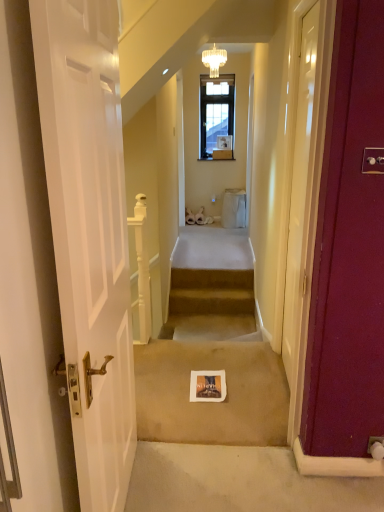
This screenshot has width=384, height=512. I want to click on white wooden door at left, which appears as the 2th door when viewed from the right, so click(89, 234).

What do you see at coordinates (211, 366) in the screenshot? I see `beige carpet at center` at bounding box center [211, 366].

Locate an element on the screen. white glossy door at right, the 2th door in the front-to-back sequence is located at coordinates (299, 192).

Describe the element at coordinates (211, 292) in the screenshot. I see `beige carpeted stairs at center` at that location.

Locate an element on the screen. beige carpeted stairs at center is located at coordinates (211, 292).

You are a GUI agent. You are given a task and a screenshot of the screen. Output one action in this format:
    pyautogui.click(x=<x>, y=<y>)
    Task: Click on the white wooden door at left, which appears as the 2th door when viewed from the right
    The height and width of the screenshot is (512, 384).
    Given the screenshot: What is the action you would take?
    pyautogui.click(x=89, y=234)

Which of these two, white wooden door at left, which ranks as the first door in front-to-back order, or beige carpet at center, is smaller?

beige carpet at center is smaller.

Considering the relative positions of white wooden door at left, marked as the second door in a back-to-front arrangement, and beige carpet at center in the image provided, is white wooden door at left, marked as the second door in a back-to-front arrangement, to the left of beige carpet at center from the viewer's perspective?

Indeed, white wooden door at left, marked as the second door in a back-to-front arrangement, is positioned on the left side of beige carpet at center.

Considering the relative sizes of white wooden door at left, which ranks as the first door in front-to-back order, and beige carpet at center in the image provided, is white wooden door at left, which ranks as the first door in front-to-back order, taller than beige carpet at center?

Indeed, white wooden door at left, which ranks as the first door in front-to-back order, has a greater height compared to beige carpet at center.

From the image's perspective, does white glossy door at right, the first door from the right, appear higher than beige carpet at center?

Yes, from the image's perspective, white glossy door at right, the first door from the right, is above beige carpet at center.

Could you tell me if white glossy door at right, which is counted as the 1th door, starting from the back, is turned towards beige carpet at center?

Yes, white glossy door at right, which is counted as the 1th door, starting from the back, faces towards beige carpet at center.

From a real-world perspective, is white glossy door at right, the first door from the right, above or below beige carpet at center?

Clearly, from a real-world perspective, white glossy door at right, the first door from the right, is above beige carpet at center.

Consider the image. Is white glossy door at right, the second door when ordered from left to right, positioned beyond the bounds of beige carpet at center?

Yes, white glossy door at right, the second door when ordered from left to right, is located beyond the bounds of beige carpet at center.

Where is `the 2nd door in front when counting from the gold textured chandelier at upper center`? The width and height of the screenshot is (384, 512). the 2nd door in front when counting from the gold textured chandelier at upper center is located at coordinates (89, 234).

From a real-world perspective, which object stands above the other?

gold textured chandelier at upper center.

Could white wooden door at left, which appears as the 2th door when viewed from the right, be considered to be inside gold textured chandelier at upper center?

Definitely not — white wooden door at left, which appears as the 2th door when viewed from the right, is not inside gold textured chandelier at upper center.

Is gold textured chandelier at upper center not close to white wooden door at left, which appears as the 2th door when viewed from the right?

Indeed, gold textured chandelier at upper center is not near white wooden door at left, which appears as the 2th door when viewed from the right.

Looking at this image, is white wooden door at left, which appears as the 2th door when viewed from the right, behind gold textured chandelier at upper center?

No, white wooden door at left, which appears as the 2th door when viewed from the right, is closer to the camera.

Between point (61, 96) and point (208, 60), which one is positioned in front?

The point (61, 96) is closer to the camera.

Who is taller, white wooden door at left, marked as the second door in a back-to-front arrangement, or gold textured chandelier at upper center?

white wooden door at left, marked as the second door in a back-to-front arrangement.

In the scene shown: Is white wooden door at left, which appears as the 2th door when viewed from the right, looking in the opposite direction of gold textured chandelier at upper center?

white wooden door at left, which appears as the 2th door when viewed from the right, does not have its back to gold textured chandelier at upper center.

Can you confirm if white glossy door at right, the 2th door in the front-to-back sequence, is thinner than white wooden door at left, which ranks as the first door in front-to-back order?

Yes, white glossy door at right, the 2th door in the front-to-back sequence, is thinner than white wooden door at left, which ranks as the first door in front-to-back order.

Does point (311, 67) appear closer or farther from the camera than point (101, 46)?

Point (311, 67) is farther from the camera than point (101, 46).

Does white glossy door at right, the first door from the right, turn towards white wooden door at left, which is the first door from left to right?

No, white glossy door at right, the first door from the right, does not turn towards white wooden door at left, which is the first door from left to right.

From the image's perspective, which object appears higher, white glossy door at right, the first door from the right, or white wooden door at left, which is the first door from left to right?

white glossy door at right, the first door from the right, is shown above in the image.

What's the angular difference between beige carpeted stairs at center and gold textured chandelier at upper center's facing directions?

The angle between the facing direction of beige carpeted stairs at center and the facing direction of gold textured chandelier at upper center is 3.2 degrees.

Does point (173, 274) appear closer or farther from the camera than point (217, 63)?

Point (173, 274) is positioned closer to the camera compared to point (217, 63).

Between beige carpeted stairs at center and gold textured chandelier at upper center, which one has larger width?

Wider between the two is gold textured chandelier at upper center.

Based on their sizes in the image, would you say beige carpeted stairs at center is bigger or smaller than gold textured chandelier at upper center?

In the image, beige carpeted stairs at center appears to be larger than gold textured chandelier at upper center.

From a real-world perspective, between beige carpeted stairs at center and white glossy door at right, the second door when ordered from left to right, who is vertically lower?

beige carpeted stairs at center.

Does beige carpeted stairs at center have a lesser height compared to white glossy door at right, the 2th door in the front-to-back sequence?

Indeed, beige carpeted stairs at center has a lesser height compared to white glossy door at right, the 2th door in the front-to-back sequence.

Is point (232, 277) positioned behind point (297, 254)?

Yes, point (232, 277) is farther from viewer.

Which of these two, beige carpeted stairs at center or white glossy door at right, the second door when ordered from left to right, is thinner?

white glossy door at right, the second door when ordered from left to right, is thinner.

Where is `stairwell that is under the white wooden door at left, marked as the second door in a back-to-front arrangement (from a real-world perspective)`? Image resolution: width=384 pixels, height=512 pixels. stairwell that is under the white wooden door at left, marked as the second door in a back-to-front arrangement (from a real-world perspective) is located at coordinates (211, 366).

This screenshot has height=512, width=384. What are the coordinates of `stairwell lying behind the white glossy door at right, the 2th door in the front-to-back sequence` in the screenshot? It's located at (211, 366).

Looking at the image, which one is located closer to gold textured chandelier at upper center, white wooden door at left, which appears as the 2th door when viewed from the right, or beige carpet at center?

The object closer to gold textured chandelier at upper center is beige carpet at center.

Estimate the real-world distances between objects in this image. Which object is further from beige carpet at center, gold textured chandelier at upper center or white wooden door at left, which is the first door from left to right?

Among the two, gold textured chandelier at upper center is located further to beige carpet at center.

When comparing their distances from gold textured chandelier at upper center, does white glossy door at right, the first door from the right, or white wooden door at left, which appears as the 2th door when viewed from the right, seem further?

white wooden door at left, which appears as the 2th door when viewed from the right.

Which object lies further to the anchor point beige carpet at center, gold textured chandelier at upper center or white glossy door at right, the 2th door in the front-to-back sequence?

gold textured chandelier at upper center lies further to beige carpet at center than the other object.

Which object lies nearer to the anchor point white glossy door at right, the first door from the right, gold textured chandelier at upper center or white wooden door at left, which ranks as the first door in front-to-back order?

Based on the image, white wooden door at left, which ranks as the first door in front-to-back order, appears to be nearer to white glossy door at right, the first door from the right.

Looking at the image, which one is located closer to white glossy door at right, the first door from the right, beige carpeted stairs at center or beige carpet at center?

The object closer to white glossy door at right, the first door from the right, is beige carpet at center.

Looking at the image, which one is located closer to white wooden door at left, which appears as the 2th door when viewed from the right, gold textured chandelier at upper center or white glossy door at right, the 2th door in the front-to-back sequence?

white glossy door at right, the 2th door in the front-to-back sequence.

From the picture: Based on their spatial positions, is gold textured chandelier at upper center or beige carpeted stairs at center closer to white wooden door at left, marked as the second door in a back-to-front arrangement?

beige carpeted stairs at center is positioned closer to the anchor white wooden door at left, marked as the second door in a back-to-front arrangement.

Locate an element on the screen. The image size is (384, 512). stairwell between white wooden door at left, which is the first door from left to right, and beige carpeted stairs at center from front to back is located at coordinates (211, 366).

Where is `stairwell positioned between white wooden door at left, which ranks as the first door in front-to-back order, and gold textured chandelier at upper center from near to far`? stairwell positioned between white wooden door at left, which ranks as the first door in front-to-back order, and gold textured chandelier at upper center from near to far is located at coordinates (211, 366).

The image size is (384, 512). I want to click on stairs between white glossy door at right, the second door when ordered from left to right, and gold textured chandelier at upper center, along the z-axis, so click(x=211, y=292).

This screenshot has width=384, height=512. I want to click on door between white wooden door at left, which appears as the 2th door when viewed from the right, and beige carpet at center, along the z-axis, so click(x=299, y=192).